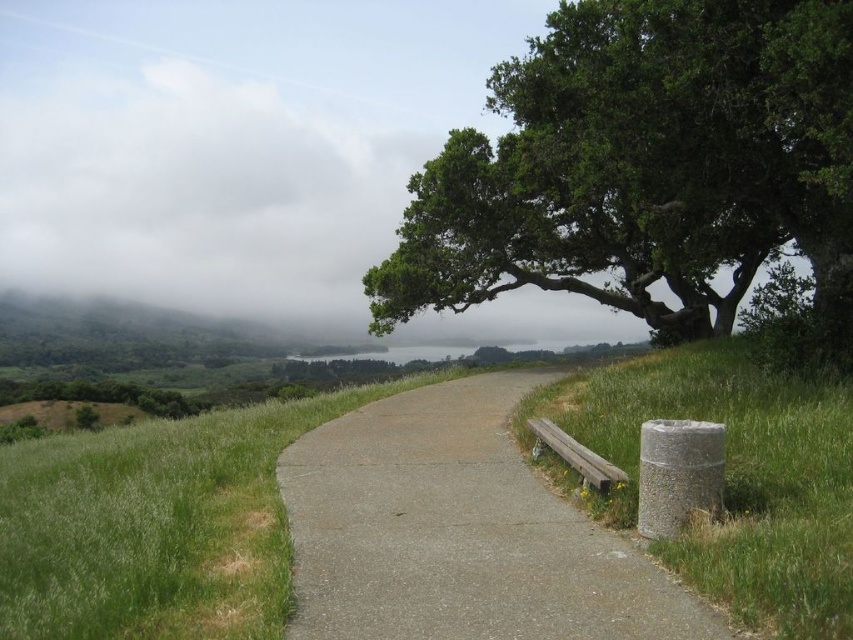
Is point (828, 342) positioned after point (299, 244)?

No, (828, 342) is in front of (299, 244).

Is point (508, 164) positioned before point (299, 156)?

Yes, it is in front of point (299, 156).

Between point (570, 275) and point (289, 148), which one is positioned behind?

The point (289, 148) is behind.

Locate an element on the screen. green leafy tree at upper right is located at coordinates [x=645, y=168].

Does point (105, 163) come farther from viewer compared to point (689, 387)?

Yes, it is.

Between point (49, 189) and point (631, 472), which one is positioned behind?

The point (49, 189) is behind.

The image size is (853, 640). Describe the element at coordinates (198, 196) in the screenshot. I see `white fluffy cloud at upper left` at that location.

At what (x,y) coordinates should I click in order to perform the action: click on white fluffy cloud at upper left. Please return your answer as a coordinate pair (x, y). This screenshot has width=853, height=640. Looking at the image, I should click on (198, 196).

Find the location of a particular element. The image size is (853, 640). white fluffy cloud at upper left is located at coordinates (198, 196).

From the picture: Can you confirm if white fluffy cloud at upper left is smaller than concrete at center?

No, white fluffy cloud at upper left is not smaller than concrete at center.

Does point (67, 108) come in front of point (357, 554)?

No, it is not.

The image size is (853, 640). What are the coordinates of `white fluffy cloud at upper left` in the screenshot? It's located at (198, 196).